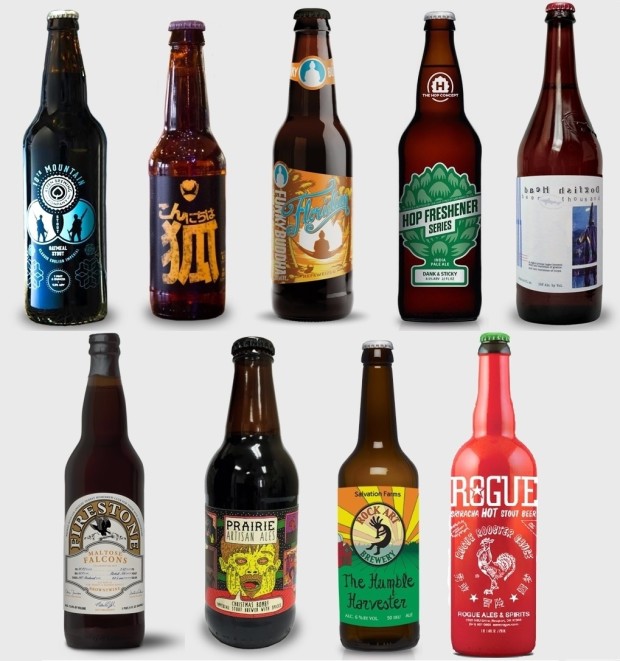
Find the location of `light reflections`. light reflections is located at coordinates (173, 108), (258, 453), (379, 445), (381, 470), (560, 129), (335, 133).